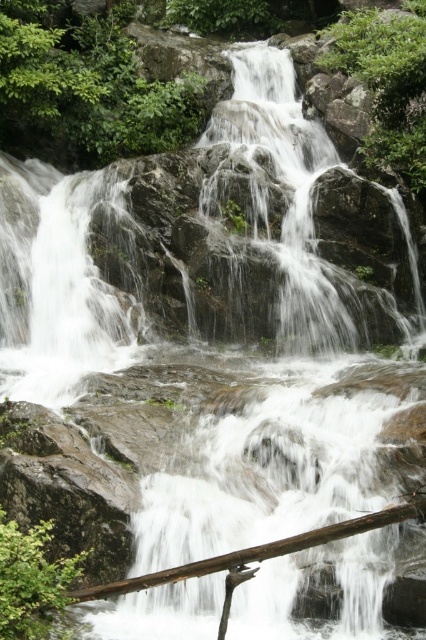
Question: Among these objects, which one is farthest from the camera?

Choices:
 (A) white smooth waterfall at left
 (B) brown wood log at lower center

Answer: (A)

Question: Is white smooth waterfall at left positioned before brown wood log at lower center?

Choices:
 (A) yes
 (B) no

Answer: (B)

Question: Does white smooth waterfall at left have a larger size compared to brown wood log at lower center?

Choices:
 (A) no
 (B) yes

Answer: (A)

Question: Which object appears farthest from the camera in this image?

Choices:
 (A) brown wood log at lower center
 (B) white smooth waterfall at left

Answer: (B)

Question: Which point appears farthest from the camera in this image?

Choices:
 (A) (39, 211)
 (B) (137, 588)

Answer: (A)

Question: Can you confirm if white smooth waterfall at left is positioned below brown wood log at lower center?

Choices:
 (A) no
 (B) yes

Answer: (A)